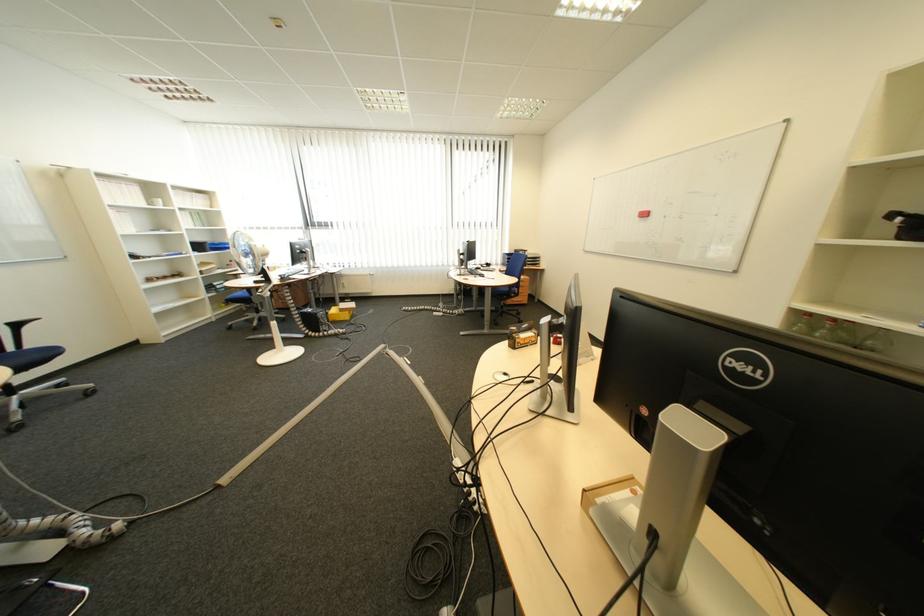
Find where to lift the white mug. Please return your answer as a coordinate pair (x, y).

(154, 201)